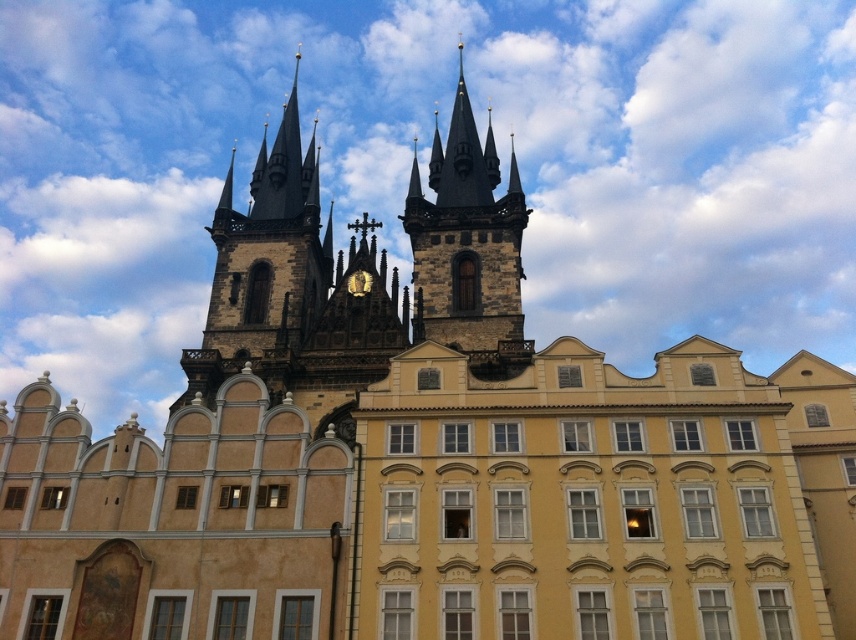
Consider the image. You are standing at a point 76.51 meters away from the point labeled point (382, 298). If you want to take a photo of the historic church with its two spires clearly visible, would your current position allow you to capture both spires in the frame?

The point labeled point (382, 298) is 76.51 meters away from you. Since the church has two spires, and you are positioned at this distance, it is likely that both spires can be captured in a single frame, assuming your camera has an appropriate lens. However, without knowing the exact field of view of your camera, it is impossible to be certain. Generally, at this distance, both spires should be visible if they are within the same general area of the church facade.

From the picture: You are a tourist who wants to take a photo of the dark gray stone tower at upper center and the dark brown stone tower at center. Which tower should you stand closer to in order to capture both in a single frame without zooming?

You should stand closer to the dark brown stone tower at center because the dark gray stone tower at upper center is taller than the dark brown stone tower at center, so positioning yourself closer to the shorter tower will help include both in the frame without zooming.

You are standing at the camera position and want to take a photo of the dark gray stone tower at upper center. If your camera has a maximum zoom range of 50 meters, will you be able to capture the tower clearly?

The dark gray stone tower at upper center and camera are 44.67 meters apart. Since the distance is within the camera maximum zoom range of 50 meters, you can capture the tower clearly.